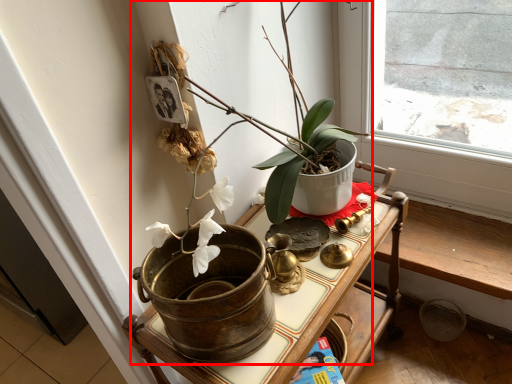
Question: Observing the image, what is the correct spatial positioning of houseplant (annotated by the red box) in reference to table?

Choices:
 (A) right
 (B) left

Answer: (B)